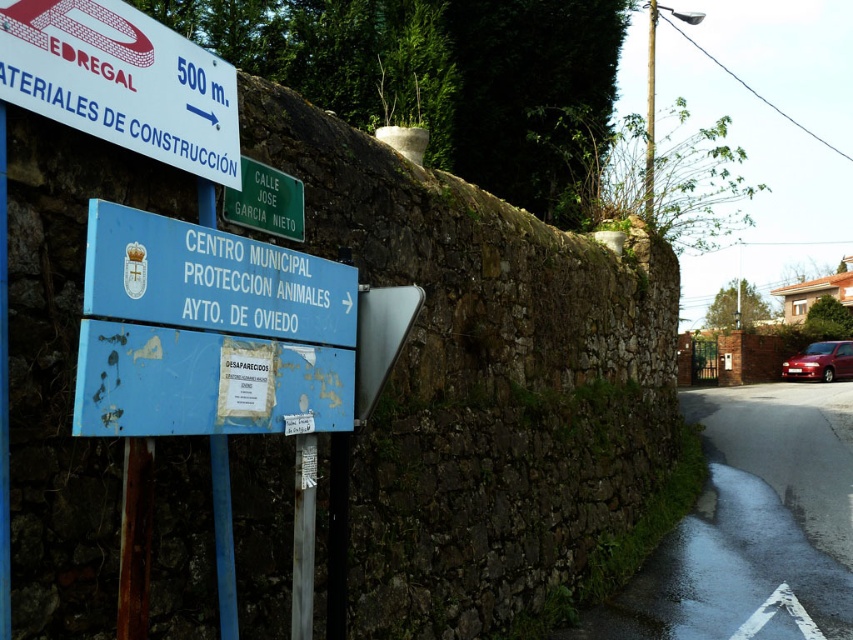
Question: Is green plastic street sign at upper center to the left of shiny red car at right from the viewer's perspective?

Choices:
 (A) no
 (B) yes

Answer: (B)

Question: Does blue painted metal sign at center have a greater width compared to green plastic street sign at upper center?

Choices:
 (A) yes
 (B) no

Answer: (A)

Question: Which point is farther from the camera taking this photo?

Choices:
 (A) (804, 365)
 (B) (276, 227)

Answer: (A)

Question: Is green plastic street sign at upper center smaller than shiny red car at right?

Choices:
 (A) yes
 (B) no

Answer: (A)

Question: Which point is closer to the camera taking this photo?

Choices:
 (A) (267, 216)
 (B) (161, 58)

Answer: (B)

Question: Which point is farther from the camera taking this photo?

Choices:
 (A) (177, 227)
 (B) (846, 369)
 (C) (236, 204)

Answer: (B)